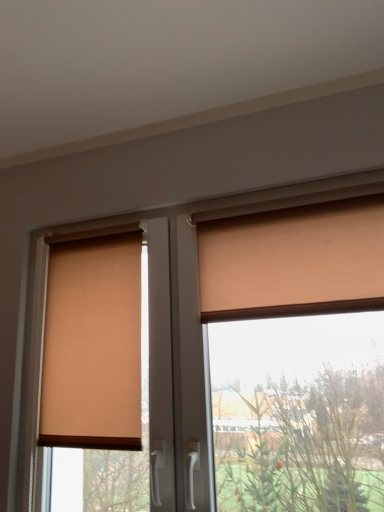
Question: Is matte orange curtain at upper right behind matte beige blind at left?

Choices:
 (A) yes
 (B) no

Answer: (B)

Question: Considering the relative sizes of matte orange curtain at upper right and matte beige blind at left in the image provided, is matte orange curtain at upper right thinner than matte beige blind at left?

Choices:
 (A) no
 (B) yes

Answer: (B)

Question: Is matte orange curtain at upper right facing towards matte beige blind at left?

Choices:
 (A) no
 (B) yes

Answer: (A)

Question: From a real-world perspective, is matte orange curtain at upper right physically above matte beige blind at left?

Choices:
 (A) yes
 (B) no

Answer: (A)

Question: Is the surface of matte orange curtain at upper right in direct contact with matte beige blind at left?

Choices:
 (A) no
 (B) yes

Answer: (A)

Question: From a real-world perspective, is matte orange curtain at upper right positioned under matte beige blind at left based on gravity?

Choices:
 (A) yes
 (B) no

Answer: (B)

Question: Considering the relative sizes of matte orange curtain at upper right and matte orange roller blind at center in the image provided, is matte orange curtain at upper right taller than matte orange roller blind at center?

Choices:
 (A) no
 (B) yes

Answer: (A)

Question: From a real-world perspective, is matte orange curtain at upper right positioned under matte orange roller blind at center based on gravity?

Choices:
 (A) no
 (B) yes

Answer: (A)

Question: Is matte orange curtain at upper right surrounding matte orange roller blind at center?

Choices:
 (A) no
 (B) yes

Answer: (A)

Question: Is matte orange curtain at upper right at the left side of matte orange roller blind at center?

Choices:
 (A) yes
 (B) no

Answer: (B)

Question: Does matte orange curtain at upper right appear on the right side of matte orange roller blind at center?

Choices:
 (A) yes
 (B) no

Answer: (A)

Question: Considering the relative sizes of matte orange curtain at upper right and matte orange roller blind at center in the image provided, is matte orange curtain at upper right thinner than matte orange roller blind at center?

Choices:
 (A) yes
 (B) no

Answer: (A)

Question: Would you consider matte orange roller blind at center to be distant from matte beige blind at left?

Choices:
 (A) yes
 (B) no

Answer: (B)